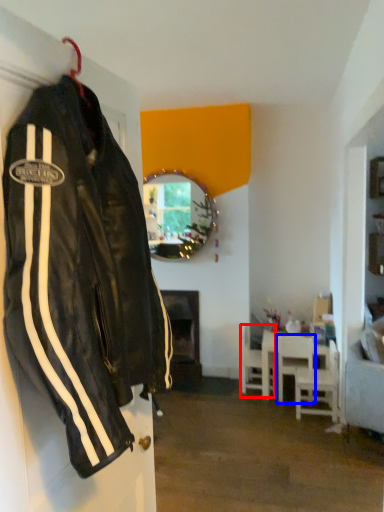
Question: Which point is closer to the camera, chair (highlighted by a red box) or chair (highlighted by a blue box)?

Choices:
 (A) chair
 (B) chair

Answer: (B)